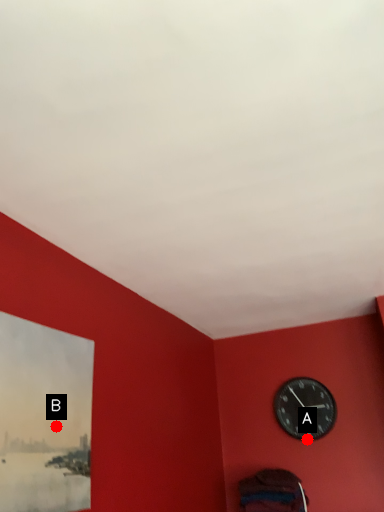
Question: Two points are circled on the image, labeled by A and B beside each circle. Which point is farther to the camera?

Choices:
 (A) A is further
 (B) B is further

Answer: (A)